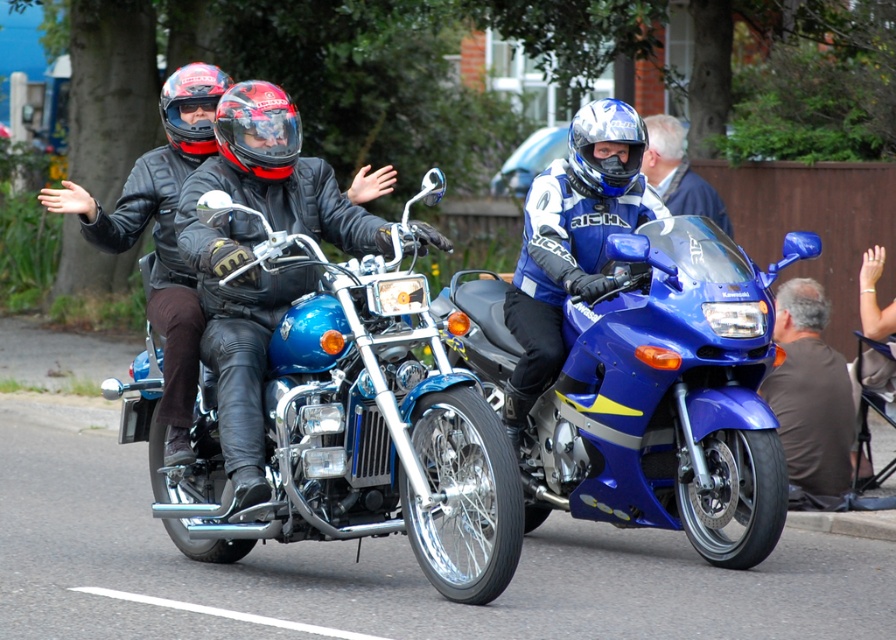
Can you confirm if glossy blue motorcycle at center is thinner than matte black helmet at upper center?

In fact, glossy blue motorcycle at center might be wider than matte black helmet at upper center.

What do you see at coordinates (668, 397) in the screenshot? I see `glossy blue motorcycle at center` at bounding box center [668, 397].

In order to click on glossy blue motorcycle at center in this screenshot , I will do `click(668, 397)`.

Does matte black leather jacket at center have a lesser height compared to blue matte helmet at center?

No, matte black leather jacket at center is not shorter than blue matte helmet at center.

Is matte black leather jacket at center further to the viewer compared to blue matte helmet at center?

No, it is not.

Where is `matte black leather jacket at center`? The image size is (896, 640). matte black leather jacket at center is located at coordinates (253, 257).

The width and height of the screenshot is (896, 640). What are the coordinates of `matte black leather jacket at center` in the screenshot? It's located at (253, 257).

Does brown cotton shirt at lower right have a larger size compared to blue leather jacket at center?

Actually, brown cotton shirt at lower right might be smaller than blue leather jacket at center.

Between brown cotton shirt at lower right and blue leather jacket at center, which one is positioned higher?

blue leather jacket at center is higher up.

Is point (776, 340) closer to viewer compared to point (705, 212)?

Yes.

You are a GUI agent. You are given a task and a screenshot of the screen. Output one action in this format:
    pyautogui.click(x=<x>, y=<y>)
    Task: Click on the brown cotton shirt at lower right
    The height and width of the screenshot is (640, 896).
    Given the screenshot: What is the action you would take?
    pyautogui.click(x=810, y=397)